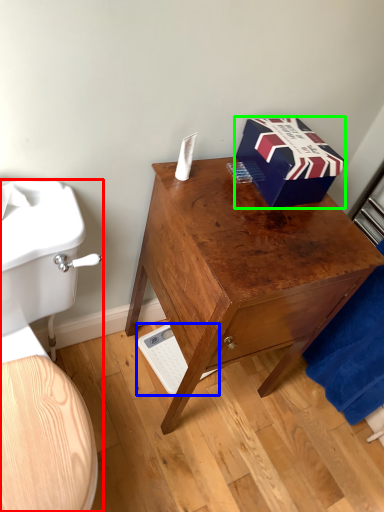
Question: Based on their relative distances, which object is nearer to toilet (highlighted by a red box)? Choose from scale (highlighted by a blue box) and box (highlighted by a green box).

Choices:
 (A) scale
 (B) box

Answer: (B)